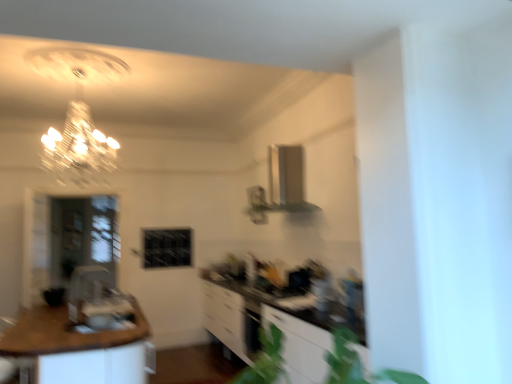
Question: Would you say white glossy cabinetry at center is to the left or to the right of brown wood countertop at lower left in the picture?

Choices:
 (A) right
 (B) left

Answer: (A)

Question: From the image's perspective, is white glossy cabinetry at center positioned above or below brown wood countertop at lower left?

Choices:
 (A) below
 (B) above

Answer: (A)

Question: Which object is positioned farthest from the brown wood countertop at lower left?

Choices:
 (A) white glossy cabinetry at center
 (B) transparent glass door at left

Answer: (B)

Question: Which object is the closest to the brown wood countertop at lower left?

Choices:
 (A) transparent glass door at left
 (B) white glossy cabinetry at center

Answer: (B)